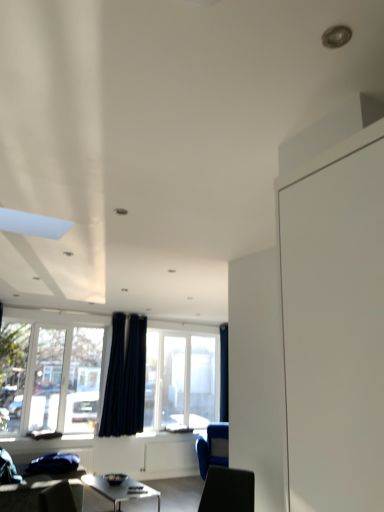
Question: From the image's perspective, is transparent glass window at center, which appears as the 2th window when viewed from the front, on dark blue fabric curtain at upper center, the first curtain when ordered from back to front?

Choices:
 (A) no
 (B) yes

Answer: (A)

Question: Is transparent glass window at center, placed as the second window when sorted from left to right, to the right of dark blue fabric curtain at upper center, arranged as the second curtain when viewed from the left, from the viewer's perspective?

Choices:
 (A) yes
 (B) no

Answer: (B)

Question: From the image's perspective, is transparent glass window at center, placed as the second window when sorted from left to right, below dark blue fabric curtain at upper center, the first curtain when ordered from back to front?

Choices:
 (A) yes
 (B) no

Answer: (A)

Question: Would you say transparent glass window at center, which appears as the first window when viewed from the right, is outside dark blue fabric curtain at upper center, the first curtain when ordered from back to front?

Choices:
 (A) yes
 (B) no

Answer: (A)

Question: Does transparent glass window at center, which appears as the first window when viewed from the right, have a greater height compared to dark blue fabric curtain at upper center, the first curtain in the right-to-left sequence?

Choices:
 (A) no
 (B) yes

Answer: (A)

Question: Is transparent glass window at center, acting as the first window starting from the back, next to dark blue fabric curtain at upper center, the 2th curtain in the front-to-back sequence, and touching it?

Choices:
 (A) yes
 (B) no

Answer: (B)

Question: Does blue fabric armchair at lower right turn towards transparent glass window at lower left, acting as the 2th window starting from the right?

Choices:
 (A) no
 (B) yes

Answer: (A)

Question: Is blue fabric armchair at lower right next to transparent glass window at lower left, the 1th window positioned from the front, and touching it?

Choices:
 (A) yes
 (B) no

Answer: (B)

Question: Can you confirm if blue fabric armchair at lower right is shorter than transparent glass window at lower left, which is the first window in left-to-right order?

Choices:
 (A) no
 (B) yes

Answer: (B)

Question: From a real-world perspective, is blue fabric armchair at lower right on top of transparent glass window at lower left, which is the first window in left-to-right order?

Choices:
 (A) yes
 (B) no

Answer: (B)

Question: Considering the relative positions of blue fabric armchair at lower right and transparent glass window at lower left, placed as the 2th window when sorted from back to front, in the image provided, is blue fabric armchair at lower right to the left of transparent glass window at lower left, placed as the 2th window when sorted from back to front, from the viewer's perspective?

Choices:
 (A) no
 (B) yes

Answer: (A)

Question: Is blue fabric armchair at lower right wider than transparent glass window at lower left, which is the first window in left-to-right order?

Choices:
 (A) yes
 (B) no

Answer: (A)

Question: Is blue fabric armchair at lower right facing towards dark blue fabric curtain at upper center, arranged as the second curtain when viewed from the left?

Choices:
 (A) no
 (B) yes

Answer: (A)